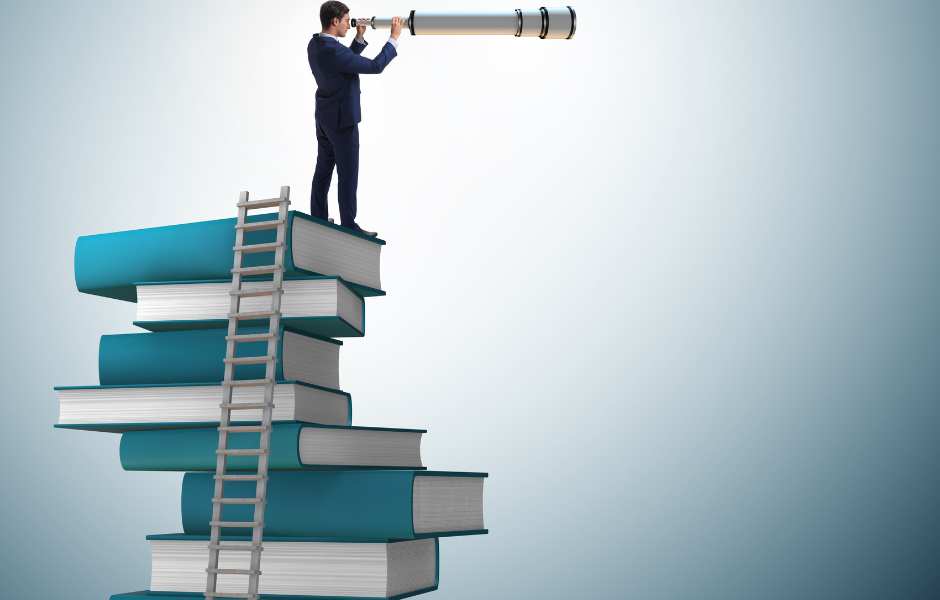
I want to click on book covers, so click(139, 594), click(314, 496), click(282, 455), click(189, 346), click(148, 255), click(336, 325), click(110, 428).